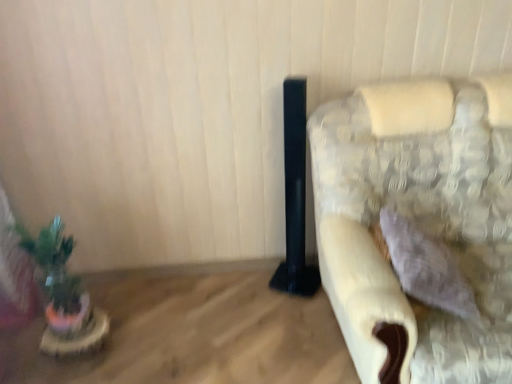
Measure the distance between point (x=201, y=321) and camera.

Point (x=201, y=321) is 2.11 meters from camera.

This screenshot has height=384, width=512. Find the location of `fluffy fabric couch at right`. fluffy fabric couch at right is located at coordinates (419, 222).

Where is `green matte plant at left`? The height and width of the screenshot is (384, 512). green matte plant at left is located at coordinates (63, 294).

Which is more distant, (37, 260) or (485, 348)?

The point (37, 260) is more distant.

Based on their positions, is green matte plant at left located to the left or right of fluffy fabric couch at right?

In the image, green matte plant at left appears on the left side of fluffy fabric couch at right.

Could you tell me if green matte plant at left is facing fluffy fabric couch at right?

No.

Which object is wider, green matte plant at left or fluffy fabric couch at right?

With larger width is fluffy fabric couch at right.

Considering the sizes of objects wooden table at lower left and fluffy fabric couch at right in the image provided, who is wider, wooden table at lower left or fluffy fabric couch at right?

wooden table at lower left is wider.

Is wooden table at lower left further to camera compared to fluffy fabric couch at right?

Yes, wooden table at lower left is behind fluffy fabric couch at right.

Is wooden table at lower left oriented away from fluffy fabric couch at right?

wooden table at lower left is not turned away from fluffy fabric couch at right.

Does wooden table at lower left have a greater height compared to fluffy fabric couch at right?

No.

In terms of size, does wooden table at lower left appear bigger or smaller than green matte plant at left?

In the image, wooden table at lower left appears to be larger than green matte plant at left.

Identify the location of houseplant that appears above the wooden table at lower left (from a real-world perspective). The width and height of the screenshot is (512, 384). (63, 294).

From a real-world perspective, which is physically above, wooden table at lower left or green matte plant at left?

In real-world perspective, green matte plant at left is above.

Is wooden table at lower left looking in the opposite direction of green matte plant at left?

No.

From the image's perspective, does fluffy fabric couch at right appear higher than green matte plant at left?

Yes, from the image's perspective, fluffy fabric couch at right is above green matte plant at left.

Would you say fluffy fabric couch at right is a long distance from green matte plant at left?

Yes.

Is fluffy fabric couch at right to the right of green matte plant at left from the viewer's perspective?

Yes, fluffy fabric couch at right is to the right of green matte plant at left.

Does fluffy fabric couch at right have a greater height compared to green matte plant at left?

Indeed, fluffy fabric couch at right has a greater height compared to green matte plant at left.

Can you confirm if green matte plant at left is bigger than wooden table at lower left?

No, green matte plant at left is not bigger than wooden table at lower left.

Are green matte plant at left and wooden table at lower left far apart?

green matte plant at left is near wooden table at lower left, not far away.

Consider the image. Considering the relative sizes of green matte plant at left and wooden table at lower left in the image provided, is green matte plant at left wider than wooden table at lower left?

No, green matte plant at left is not wider than wooden table at lower left.

Is green matte plant at left to the left of wooden table at lower left from the viewer's perspective?

Yes.

Are fluffy fabric couch at right and wooden table at lower left beside each other?

No, fluffy fabric couch at right is not next to wooden table at lower left.

Which is in front, point (383, 364) or point (155, 282)?

The point (383, 364) is in front.

In the scene shown: Can you confirm if fluffy fabric couch at right is wider than wooden table at lower left?

No, fluffy fabric couch at right is not wider than wooden table at lower left.

Choose the correct answer: Is fluffy fabric couch at right inside wooden table at lower left or outside it?

fluffy fabric couch at right is spatially situated outside wooden table at lower left.

Identify the location of furniture in front of the green matte plant at left. This screenshot has width=512, height=384. (419, 222).

The width and height of the screenshot is (512, 384). What are the coordinates of `table that appears below the fluffy fabric couch at right (from the image's perspective)` in the screenshot? It's located at (193, 331).

From the image, which object appears to be nearer to wooden table at lower left, green matte plant at left or fluffy fabric couch at right?

Based on the image, green matte plant at left appears to be nearer to wooden table at lower left.

Based on their spatial positions, is fluffy fabric couch at right or green matte plant at left closer to wooden table at lower left?

Among the two, green matte plant at left is located nearer to wooden table at lower left.

Which object lies nearer to the anchor point green matte plant at left, fluffy fabric couch at right or wooden table at lower left?

Among the two, wooden table at lower left is located nearer to green matte plant at left.

Which object lies further to the anchor point fluffy fabric couch at right, green matte plant at left or wooden table at lower left?

Among the two, green matte plant at left is located further to fluffy fabric couch at right.

From the picture: Looking at the image, which one is located further to green matte plant at left, wooden table at lower left or fluffy fabric couch at right?

The object further to green matte plant at left is fluffy fabric couch at right.

Considering their positions, is wooden table at lower left positioned further to fluffy fabric couch at right than green matte plant at left?

green matte plant at left is further to fluffy fabric couch at right.

The height and width of the screenshot is (384, 512). What are the coordinates of `table between green matte plant at left and fluffy fabric couch at right from left to right` in the screenshot? It's located at (193, 331).